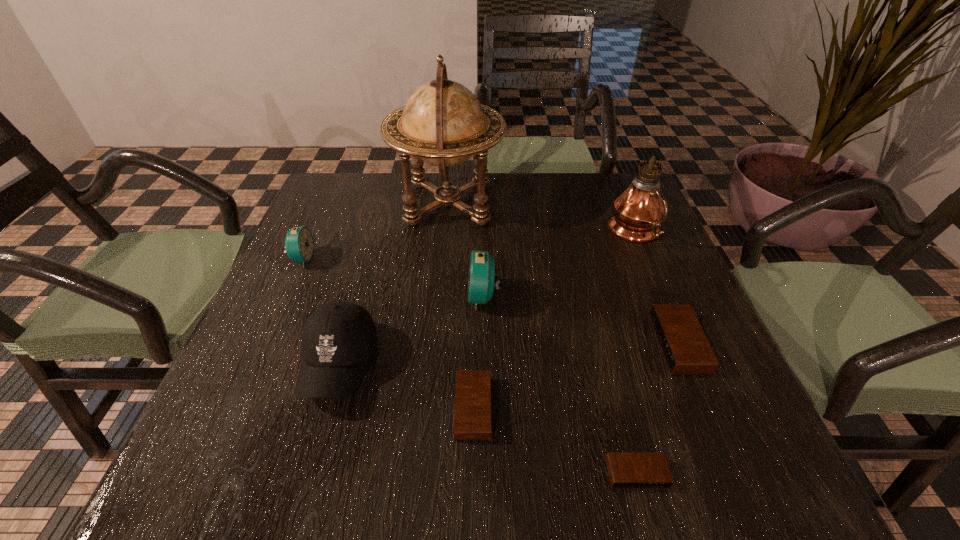
Where is `alarm clock object that ranks as the third closest to the third tallest alarm clock`? alarm clock object that ranks as the third closest to the third tallest alarm clock is located at coordinates (472, 416).

Choose which black alarm clock is the second nearest neighbor to the black baseball cap. Please provide its 2D coordinates. Your answer should be formatted as a tuple, i.e. [(x, y)], where the tuple contains the x and y coordinates of a point satisfying the conditions above.

[(626, 470)]

Locate an element on the screen. black alarm clock that is the closest to the globe is located at coordinates (686, 350).